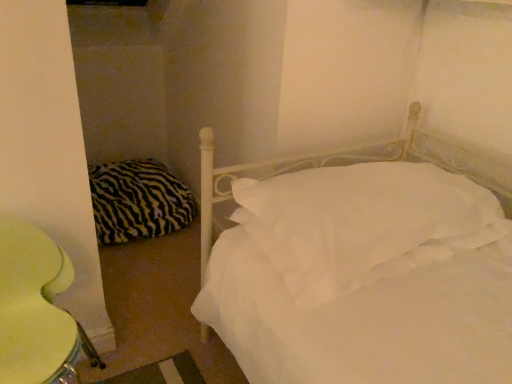
Question: From the image's perspective, is white soft pillow at center, which is counted as the 2th pillow, starting from the back, on yellow fabric swivel chair at lower left?

Choices:
 (A) yes
 (B) no

Answer: (A)

Question: Is white soft pillow at center, which is counted as the 1th pillow, starting from the front, bigger than yellow fabric swivel chair at lower left?

Choices:
 (A) yes
 (B) no

Answer: (A)

Question: Considering the relative sizes of white soft pillow at center, positioned as the 1th pillow in right-to-left order, and yellow fabric swivel chair at lower left in the image provided, is white soft pillow at center, positioned as the 1th pillow in right-to-left order, shorter than yellow fabric swivel chair at lower left?

Choices:
 (A) no
 (B) yes

Answer: (B)

Question: Is white soft pillow at center, positioned as the 1th pillow in right-to-left order, at the left side of yellow fabric swivel chair at lower left?

Choices:
 (A) no
 (B) yes

Answer: (A)

Question: Can you confirm if white soft pillow at center, which is counted as the 2th pillow, starting from the left, is taller than yellow fabric swivel chair at lower left?

Choices:
 (A) no
 (B) yes

Answer: (A)

Question: Is white soft pillow at center, which is counted as the 2th pillow, starting from the left, touching yellow fabric swivel chair at lower left?

Choices:
 (A) yes
 (B) no

Answer: (B)

Question: Is yellow fabric swivel chair at lower left to the left of white soft pillow at center, positioned as the 1th pillow in right-to-left order, from the viewer's perspective?

Choices:
 (A) yes
 (B) no

Answer: (A)

Question: Is white soft pillow at center, which is counted as the 1th pillow, starting from the front, a part of yellow fabric swivel chair at lower left?

Choices:
 (A) yes
 (B) no

Answer: (B)

Question: From the image's perspective, does yellow fabric swivel chair at lower left appear lower than white soft pillow at center, which is counted as the 2th pillow, starting from the back?

Choices:
 (A) no
 (B) yes

Answer: (B)

Question: Does yellow fabric swivel chair at lower left have a larger size compared to white soft pillow at center, which is counted as the 2th pillow, starting from the back?

Choices:
 (A) no
 (B) yes

Answer: (A)

Question: Can you confirm if yellow fabric swivel chair at lower left is taller than white soft pillow at center, which is counted as the 2th pillow, starting from the left?

Choices:
 (A) yes
 (B) no

Answer: (A)

Question: Is the depth of yellow fabric swivel chair at lower left less than that of white soft pillow at center, which is counted as the 2th pillow, starting from the back?

Choices:
 (A) no
 (B) yes

Answer: (B)

Question: From a real-world perspective, is zebra-patterned fabric pillow at left, the second pillow when ordered from front to back, positioned over yellow fabric swivel chair at lower left based on gravity?

Choices:
 (A) yes
 (B) no

Answer: (B)